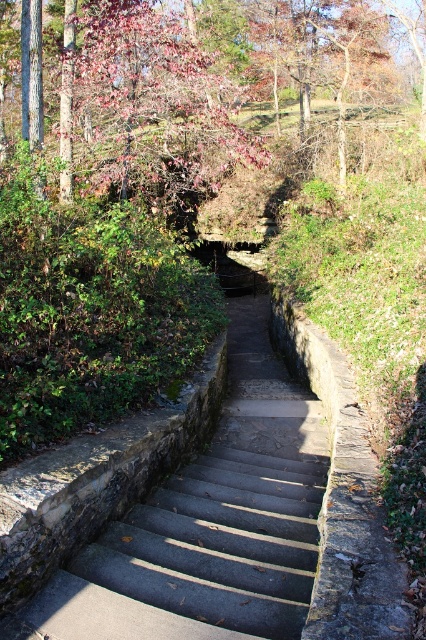
Is point (328, 3) closer to viewer compared to point (51, 612)?

No, (328, 3) is further to viewer.

Is reddish-brown bark tree at upper center thinner than smooth concrete stairs at center?

No, reddish-brown bark tree at upper center is not thinner than smooth concrete stairs at center.

Identify the location of reddish-brown bark tree at upper center. The width and height of the screenshot is (426, 640). coord(181,90).